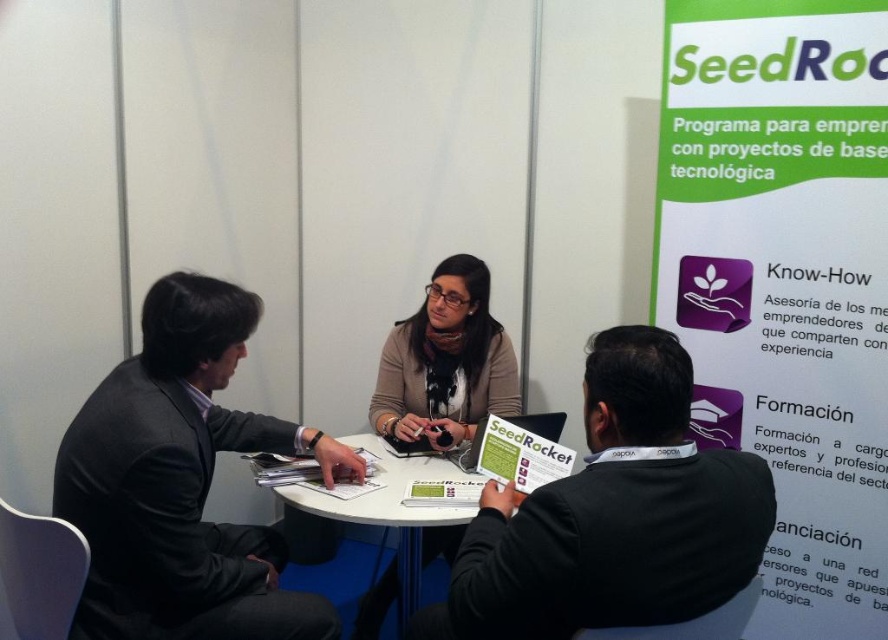
You are attending a networking event and want to know if the dark gray suit at left is wider than the matte beige sweater at center. Can you determine this based on the scene?

The dark gray suit at left is wider than the matte beige sweater at center, as stated in the description.

What is the color of the sweater at the point specified by the coordinates (x=614, y=515)?

The point at coordinates (x=614, y=515) is on a black sweater at center.

What is located at the coordinates point (x=614, y=515) in the image?

The point (x=614, y=515) indicates the location of the black sweater at center.